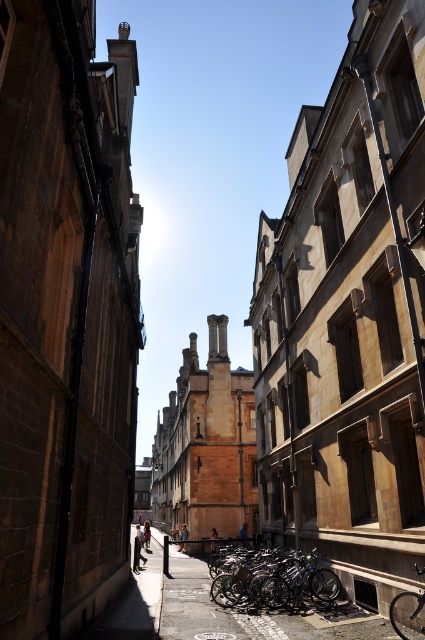
You are standing at the camera position and want to reach the shiny metallic bicycles at center. The path between you and the bicycles is blocked by a low wall that is 1.5 meters tall. Can you step over it to reach the bicycles?

The distance between you and the shiny metallic bicycles at center is 20.94 meters. The low wall is only 1.5 meters tall, so yes, you can step over the wall to reach the bicycles.

You are a delivery person who needs to park your shiny metallic bicycle at center near the smooth concrete pavement at center. Can you park it there without moving more than 5 meters?

The smooth concrete pavement at center and shiny metallic bicycle at center are 4.74 meters apart from each other. Since 4.74 meters is less than 5 meters, you can park the shiny metallic bicycle at center near the smooth concrete pavement at center without moving more than 5 meters.

You are a delivery person trying to park your shiny metallic bicycles at center and shiny metallic bicycle at center in a narrow alley. Can both fit side by side if the alley is 1.8 meters wide?

The shiny metallic bicycles at center are wider than the shiny metallic bicycle at center. Since the alley is only 1.8 meters wide, it depends on the combined width of both bicycles. If their total width exceeds 1.8 meters, they won